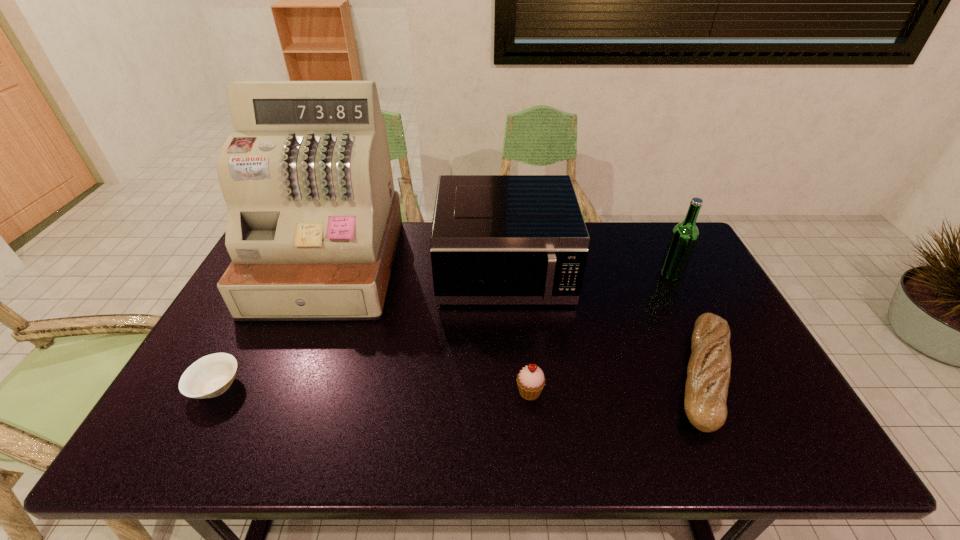
Image resolution: width=960 pixels, height=540 pixels. Find the location of `cash register`. cash register is located at coordinates (313, 223).

You are a GUI agent. You are given a task and a screenshot of the screen. Output one action in this format:
    pyautogui.click(x=<x>, y=<y>)
    Task: Click on the beer bottle
    
    Given the screenshot: What is the action you would take?
    pyautogui.click(x=684, y=236)

Locate an element on the screen. Image resolution: width=960 pixels, height=540 pixels. microwave_oven is located at coordinates pos(495,239).

Image resolution: width=960 pixels, height=540 pixels. In order to click on cupcake in this screenshot , I will do `click(530, 380)`.

I want to click on baguet, so click(708, 373).

Identify the location of the shortest object. This screenshot has height=540, width=960. (210, 376).

The image size is (960, 540). Identify the location of blank area located on the operating side of the cash register. (268, 415).

What are the coordinates of `vacant space located 0.050m on the left of the beer bottle` in the screenshot? It's located at (644, 274).

This screenshot has height=540, width=960. What are the coordinates of `vacant space located 0.350m on the front-facing side of the microwave_oven` in the screenshot? It's located at (514, 427).

At what (x,y) coordinates should I click in order to perform the action: click on vacant space located 0.070m on the left of the fourth tallest object. Please return your answer as a coordinate pair (x, y). Looking at the image, I should click on click(x=487, y=392).